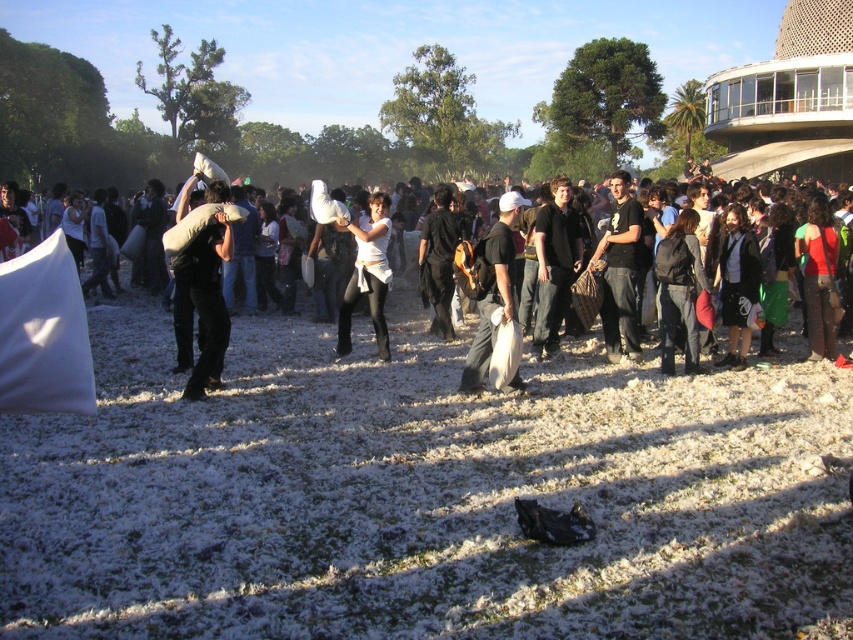
Is point (752, 266) behind point (384, 342)?

No, it is in front of (384, 342).

Between dark brown leather jacket at center-right and white matte shirt at center, which one is positioned higher?

white matte shirt at center is higher up.

Does point (718, 241) lie behind point (370, 208)?

That is False.

Where is `dark brown leather jacket at center-right`? Image resolution: width=853 pixels, height=640 pixels. dark brown leather jacket at center-right is located at coordinates (735, 280).

Is white fabric pillow at center wider than white matte shirt at center?

Yes, white fabric pillow at center is wider than white matte shirt at center.

Between point (198, 256) and point (347, 228), which one is positioned behind?

Positioned behind is point (347, 228).

Where is `white fabric pillow at center`? The height and width of the screenshot is (640, 853). white fabric pillow at center is located at coordinates (204, 275).

In the scene shown: Does dark brown leather jacket at center appear on the left side of white matte shirt at center?

No, dark brown leather jacket at center is not to the left of white matte shirt at center.

Is dark brown leather jacket at center shorter than white matte shirt at center?

Yes.

You are a GUI agent. You are given a task and a screenshot of the screen. Output one action in this format:
    pyautogui.click(x=<x>, y=<y>)
    Task: Click on the dark brown leather jacket at center
    The width and height of the screenshot is (853, 640).
    Given the screenshot: What is the action you would take?
    pyautogui.click(x=554, y=264)